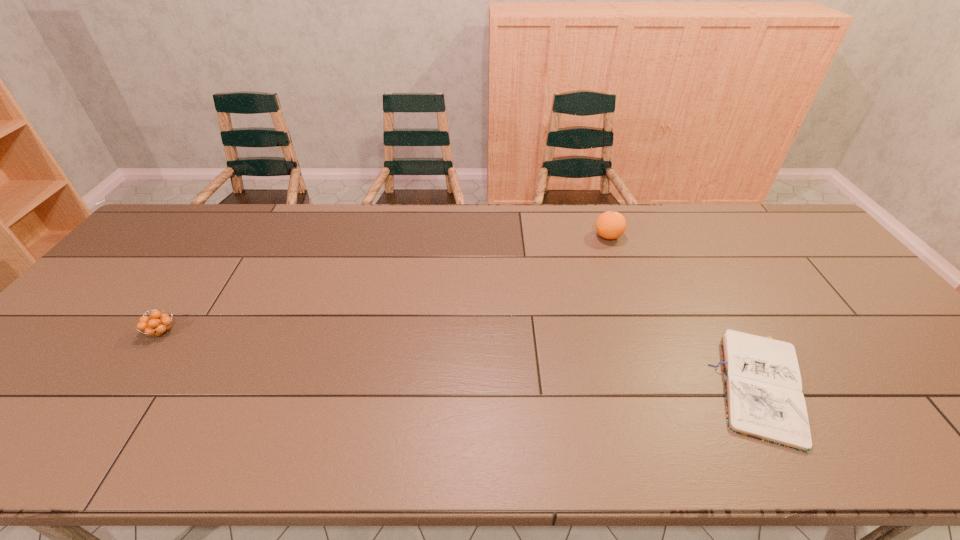
Locate an element on the screen. This screenshot has height=540, width=960. the tallest object is located at coordinates (610, 225).

Locate an element on the screen. The image size is (960, 540). the farther orange fruit is located at coordinates (610, 225).

Where is `the nearer orange fruit`? the nearer orange fruit is located at coordinates (157, 324).

The height and width of the screenshot is (540, 960). I want to click on the leftmost object, so click(157, 324).

Find the location of a particular element. notebook is located at coordinates (764, 400).

Where is `the rightmost object`? This screenshot has height=540, width=960. the rightmost object is located at coordinates (764, 400).

What are the coordinates of `vacant space located on the left of the tallest object` in the screenshot? It's located at (496, 237).

The height and width of the screenshot is (540, 960). What are the coordinates of `vacant space located on the left of the shorter orange fruit` in the screenshot? It's located at (124, 332).

You are a GUI agent. You are given a task and a screenshot of the screen. Output one action in this format:
    pyautogui.click(x=<x>, y=<y>)
    Task: Click on the free space located on the right of the notebook
    The image size is (960, 540).
    Given the screenshot: What is the action you would take?
    pyautogui.click(x=927, y=388)

I want to click on object that is positioned at the far edge, so click(610, 225).